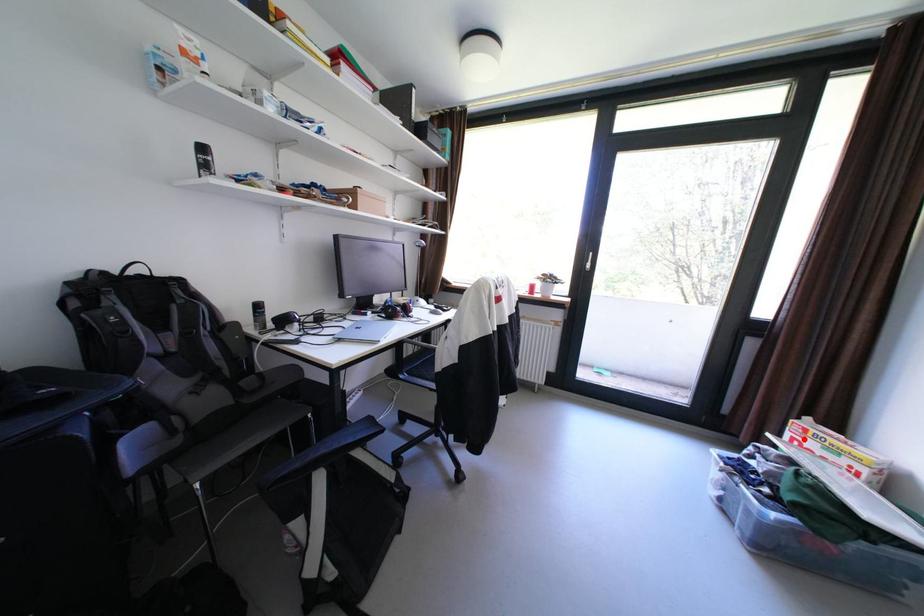
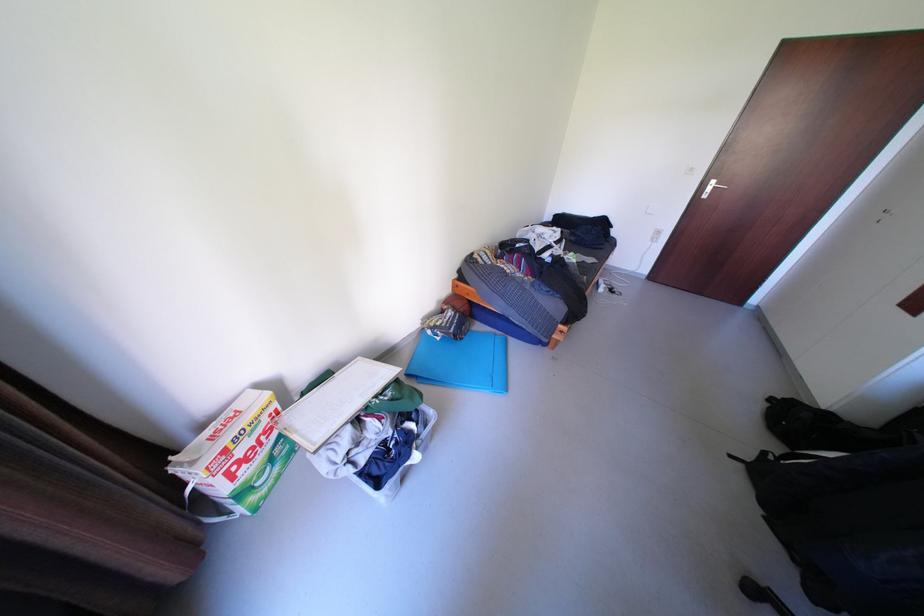
In the second image, find the point that corresponds to the highlighted location in the first image.

(237, 474)